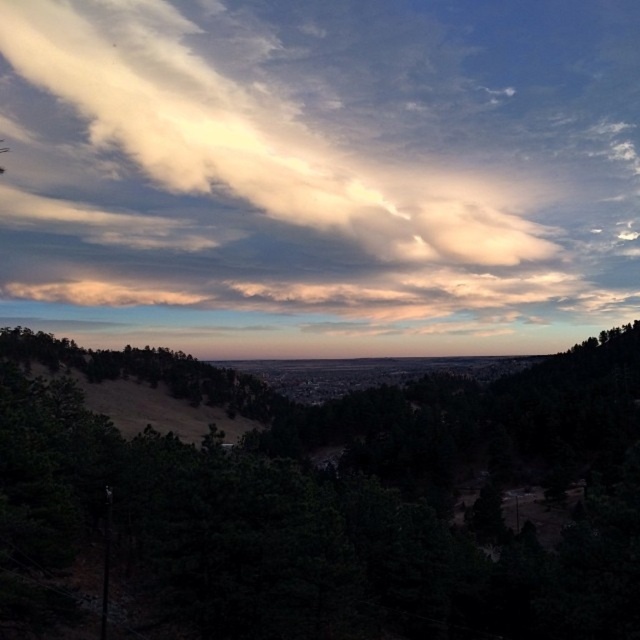
Question: Is white fluffy cloud at upper center wider than dark green leafy tree at center?

Choices:
 (A) no
 (B) yes

Answer: (B)

Question: Is white fluffy cloud at upper center further to camera compared to dark green leafy tree at center?

Choices:
 (A) yes
 (B) no

Answer: (A)

Question: From the image, what is the correct spatial relationship of white fluffy cloud at upper center in relation to dark green leafy tree at center?

Choices:
 (A) above
 (B) below

Answer: (A)

Question: Which object is farther from the camera taking this photo?

Choices:
 (A) white fluffy cloud at upper center
 (B) dark green leafy tree at center

Answer: (A)